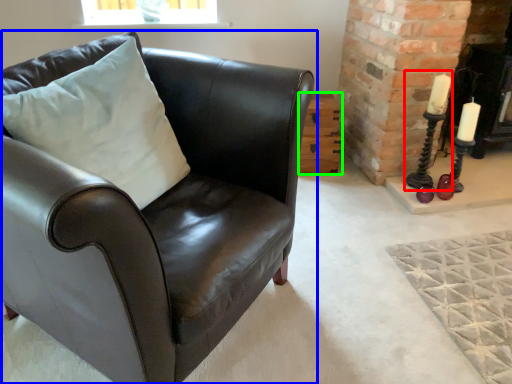
Question: Estimate the real-world distances between objects in this image. Which object is farther from candle holder (highlighted by a red box), chair (highlighted by a blue box) or table (highlighted by a green box)?

Choices:
 (A) chair
 (B) table

Answer: (A)